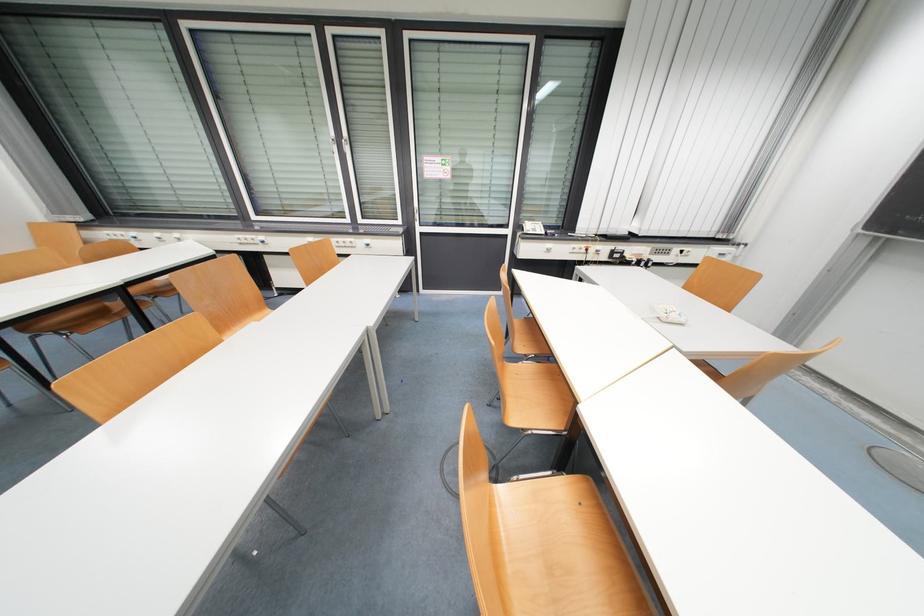
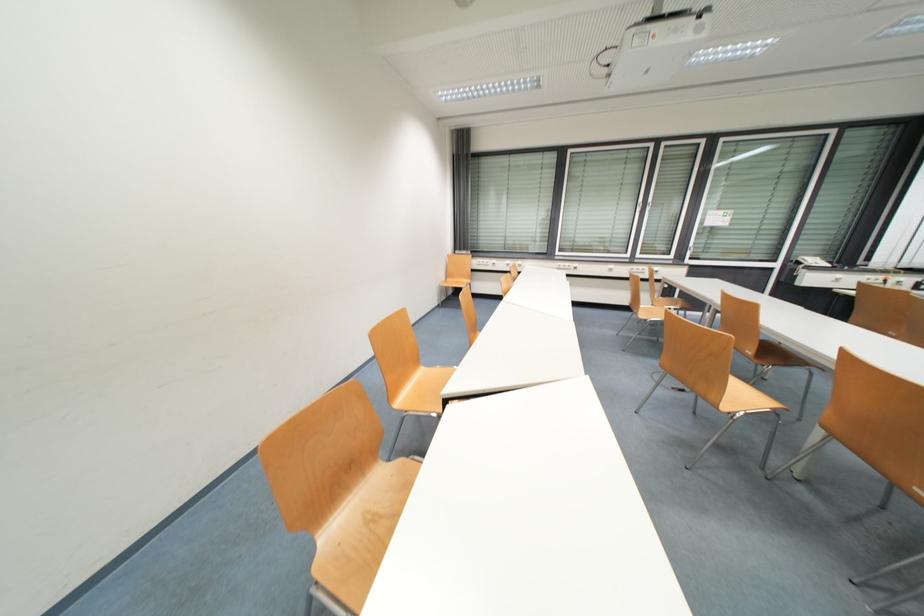
The images are taken continuously from a first-person perspective. In which direction are you moving?

The cameraman walked toward left, backward.